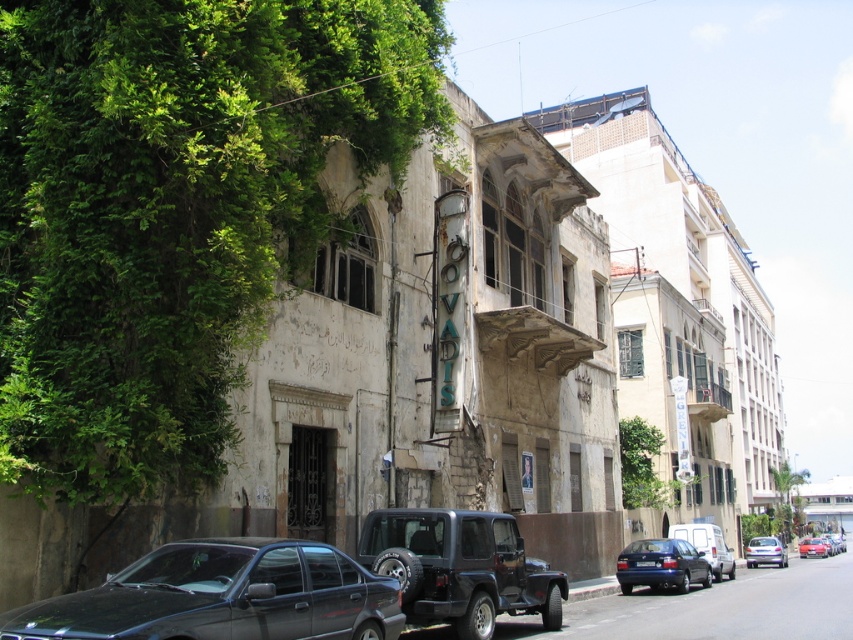
You are a botanist examining the urban environment. You see the green leafy vines at left. Where exactly are they located in the image?

The green leafy vines at left are located at point (173, 209).

You are a delivery driver who needs to back out of a parking spot between the green leafy vines at left and the silver metallic van at center. Can you see the road behind you clearly?

The green leafy vines at left are in front of the silver metallic van at center, so they may block your view when backing out. It is recommended to check for obstructions before reversing.

You are a delivery person trying to park your 6.5 feet tall truck. You see the shiny black sedan at lower left and the silver metallic van at center in the parking lot. Which vehicle should you avoid parking next to to ensure your truck doesn

The shiny black sedan at lower left is not as tall as the silver metallic van at center. Therefore, you should avoid parking next to the silver metallic van at center because it is taller and may obstruct your truck.